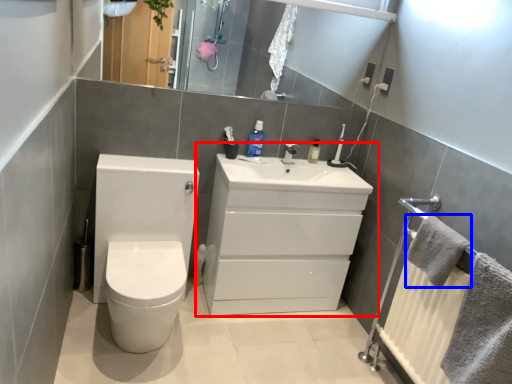
Question: Which object is further to the camera taking this photo, bathroom cabinet (highlighted by a red box) or bath towel (highlighted by a blue box)?

Choices:
 (A) bathroom cabinet
 (B) bath towel

Answer: (A)